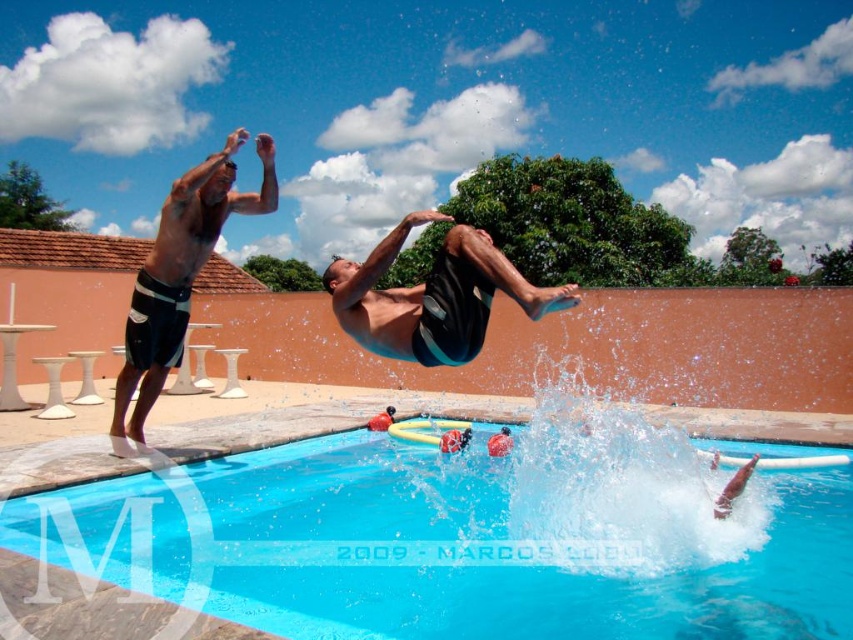
You are standing at the edge of the pool and want to jump into the blue smooth water at center. Is the point at coordinates point (x=469, y=540) a good spot to aim for?

Yes, the point at coordinates point (x=469, y=540) is on the blue smooth water at center, so it is a good spot to aim for.

You are at the pool and want to jump into the water. You see the blue smooth water at center and the black matte shorts at center. Which direction should you jump to land in the water?

You should jump to the right of the black matte shorts at center because the blue smooth water at center is located to the right of it.

You are a photographer trying to capture the two individuals in the scene. Which of the two black matte shorts at center and black matte shorts at left is positioned to the right side of the other?

The black matte shorts at center is positioned to the right of the black matte shorts at left.